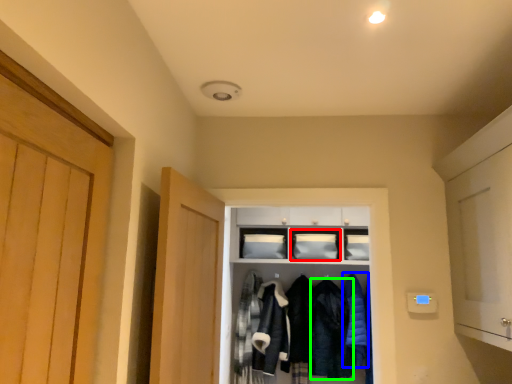
Question: Which object is positioned closest to cabinetry (highlighted by a red box)? Select from clothing (highlighted by a blue box) and clothing (highlighted by a green box).

Choices:
 (A) clothing
 (B) clothing

Answer: (A)